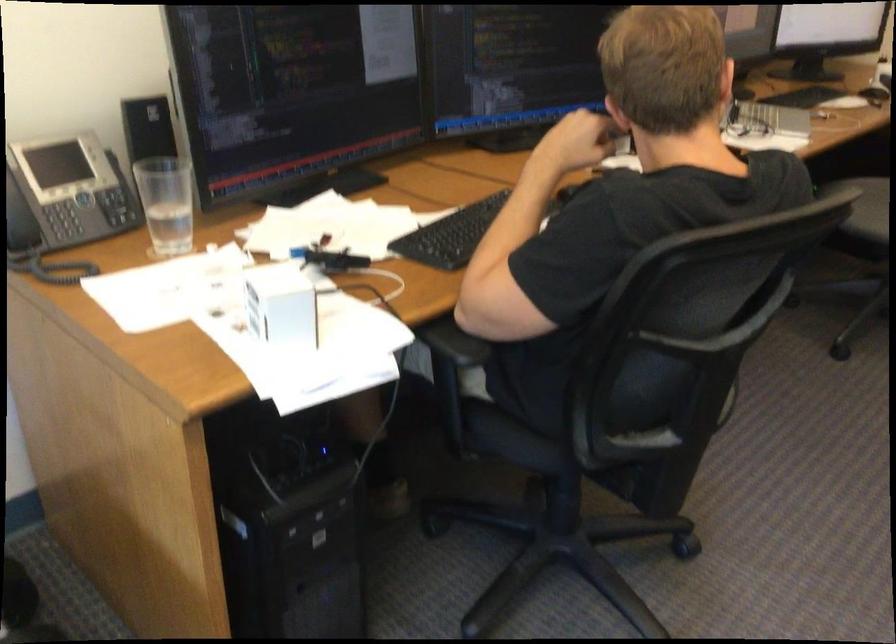
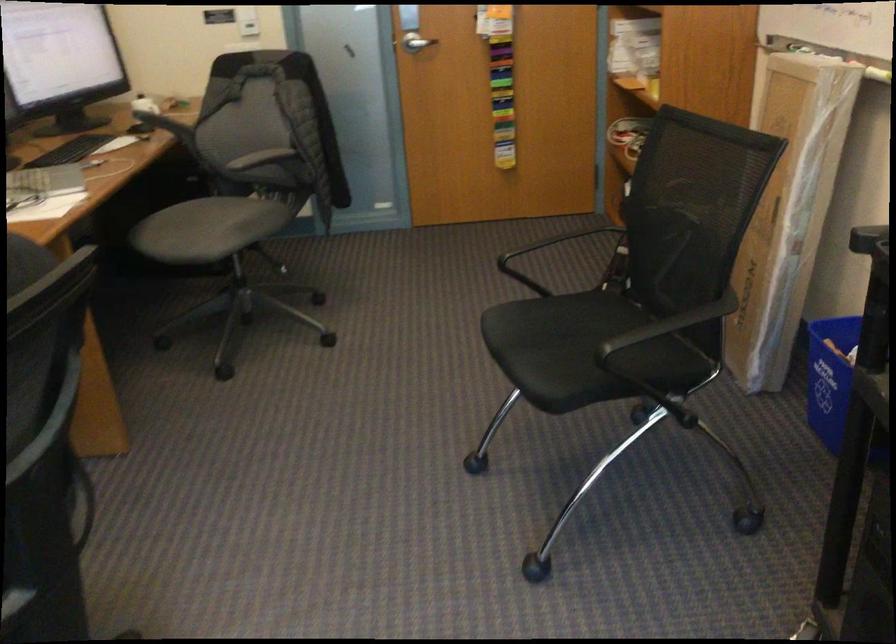
Question: The camera is either moving clockwise (left) or counter-clockwise (right) around the object. The first image is from the beginning of the video and the second image is from the end. Is the camera moving left or right when shooting the video?

Choices:
 (A) Left
 (B) Right

Answer: (A)